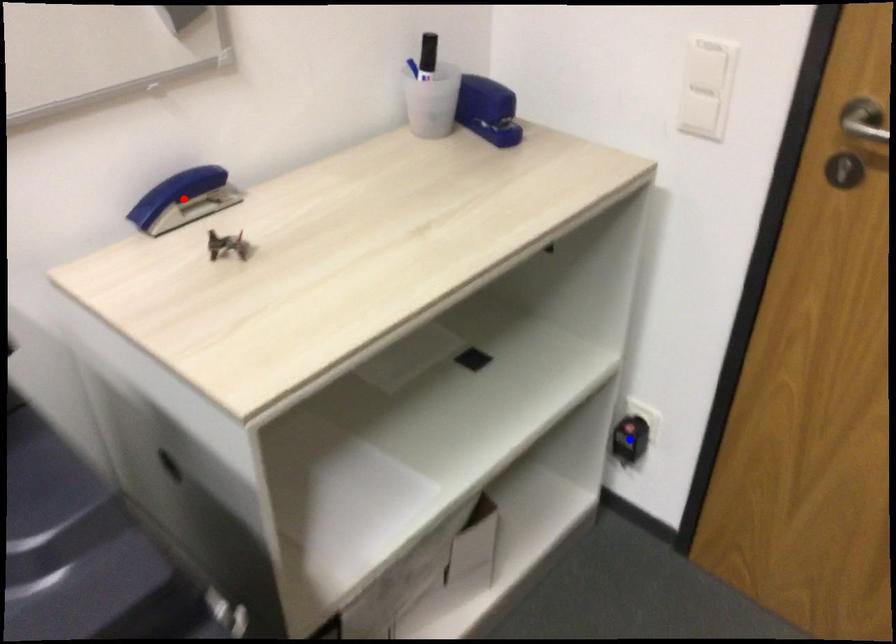
Question: In the image, two points are highlighted. Which point is nearer to the camera? Reply with the corresponding letter.

Choices:
 (A) blue point
 (B) red point

Answer: (B)